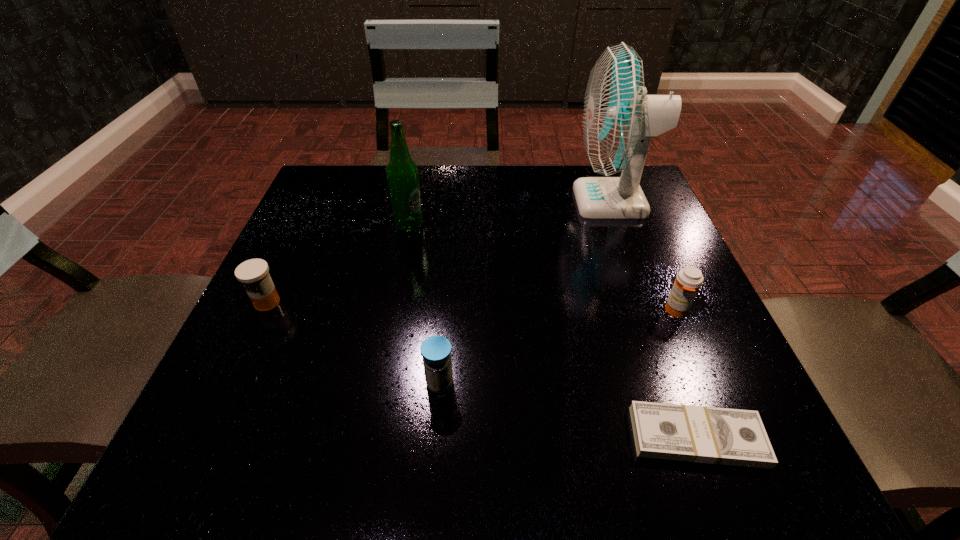
The image size is (960, 540). Identify the location of fan. (619, 119).

At what (x,y) coordinates should I click in order to perform the action: click on the fifth shortest object. Please return your answer as a coordinate pair (x, y). This screenshot has width=960, height=540. Looking at the image, I should click on (402, 174).

The height and width of the screenshot is (540, 960). I want to click on beer bottle, so click(402, 174).

The height and width of the screenshot is (540, 960). In order to click on the rightmost medicine in this screenshot , I will do `click(688, 281)`.

You are a GUI agent. You are given a task and a screenshot of the screen. Output one action in this format:
    pyautogui.click(x=<x>, y=<y>)
    Task: Click on the second medicine from left to right
    The width and height of the screenshot is (960, 540).
    Given the screenshot: What is the action you would take?
    click(x=436, y=350)

Where is `the third object from left to right`? The width and height of the screenshot is (960, 540). the third object from left to right is located at coordinates (x=436, y=350).

Locate an element on the screen. the leftmost medicine is located at coordinates (253, 273).

Where is `the nearest object`? the nearest object is located at coordinates (700, 434).

Find the location of a particular element. The image size is (960, 540). the shortest object is located at coordinates (700, 434).

Where is `blank space located in front of the fan to face the airflow`? Image resolution: width=960 pixels, height=540 pixels. blank space located in front of the fan to face the airflow is located at coordinates (480, 201).